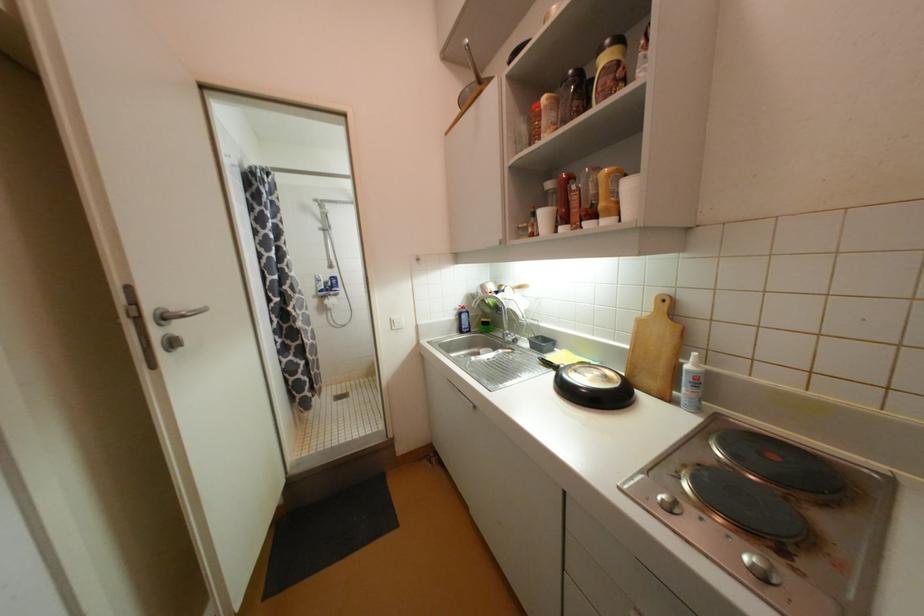
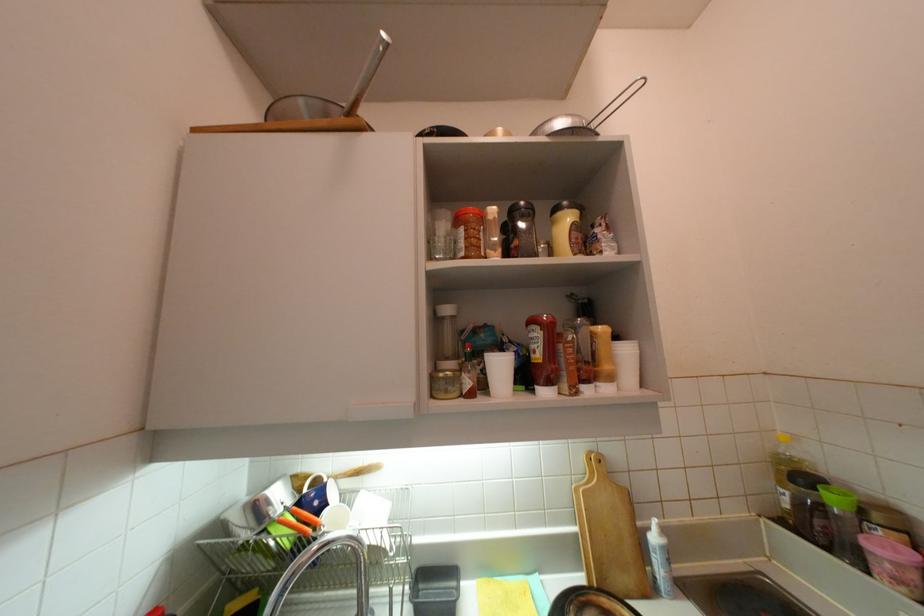
Based on the continuous images, in which direction is the camera rotating?

The camera's rotation is toward right-up.